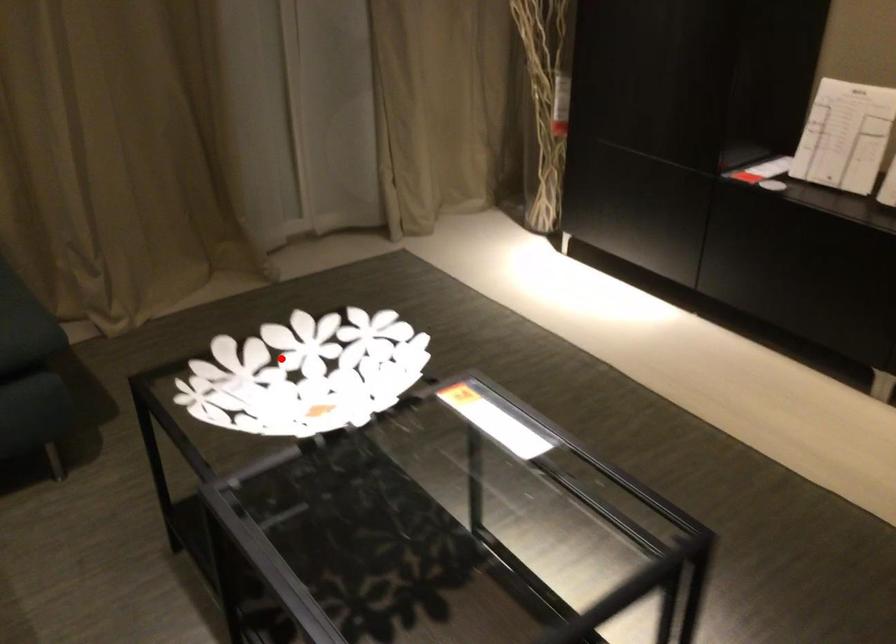
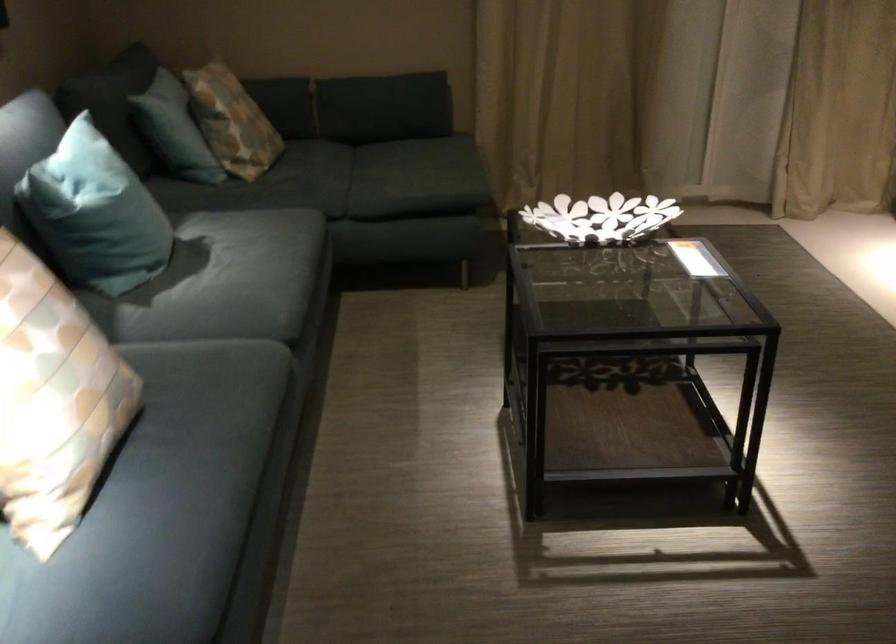
Locate, in the second image, the point that corresponds to the highlighted location in the first image.

(600, 218)